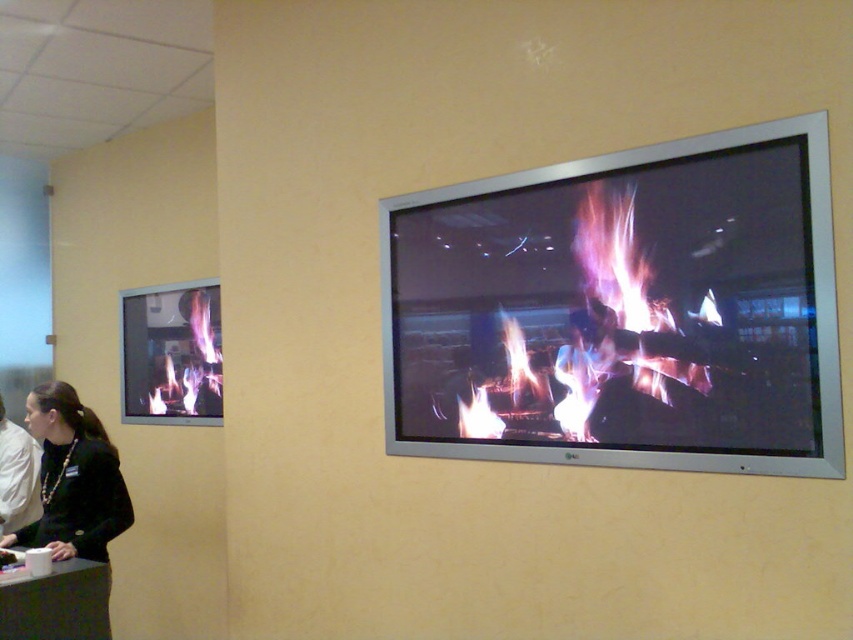
You are a person standing in the room and want to hang a picture frame that is 1.2 meters tall on the wall. The frame must be placed above an object that is shorter than it. Which object between the black fabric jacket at lower left and the matte black fireplace at left can you choose?

The black fabric jacket at lower left has a greater height compared to matte black fireplace at left. Therefore, the matte black fireplace at left is shorter and can have the picture frame placed above it since it is shorter than the frame.

You are an interior designer assessing a living room. You see the metallic silver screen at upper right and the matte black fireplace at left. Which object is taller?

The metallic silver screen at upper right is much taller than the matte black fireplace at left.

You are an interior designer assessing the placement of the metallic silver screen at upper right and the matte black fireplace at left. Based on their positions, which object is located above the other?

The metallic silver screen at upper right is positioned over the matte black fireplace at left, meaning it is above the fireplace.